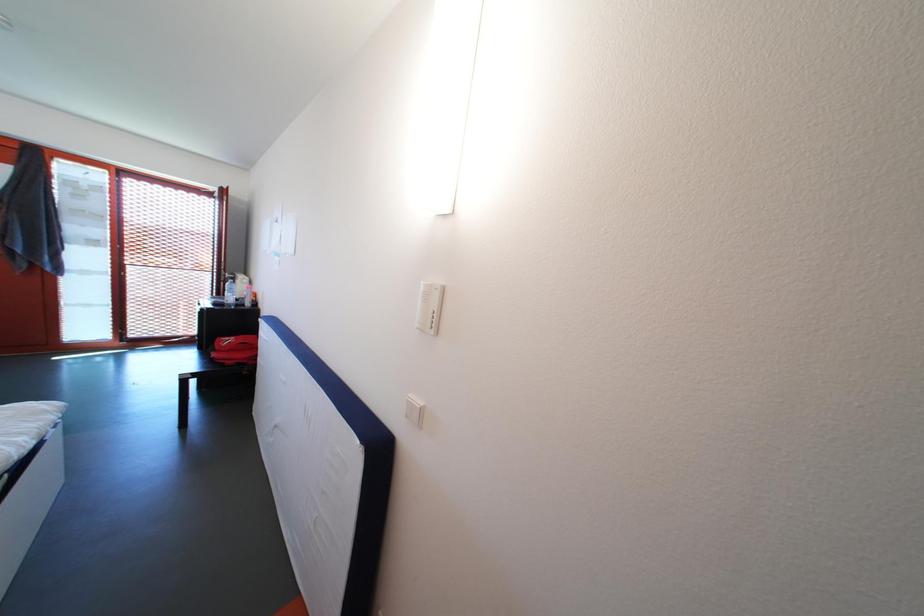
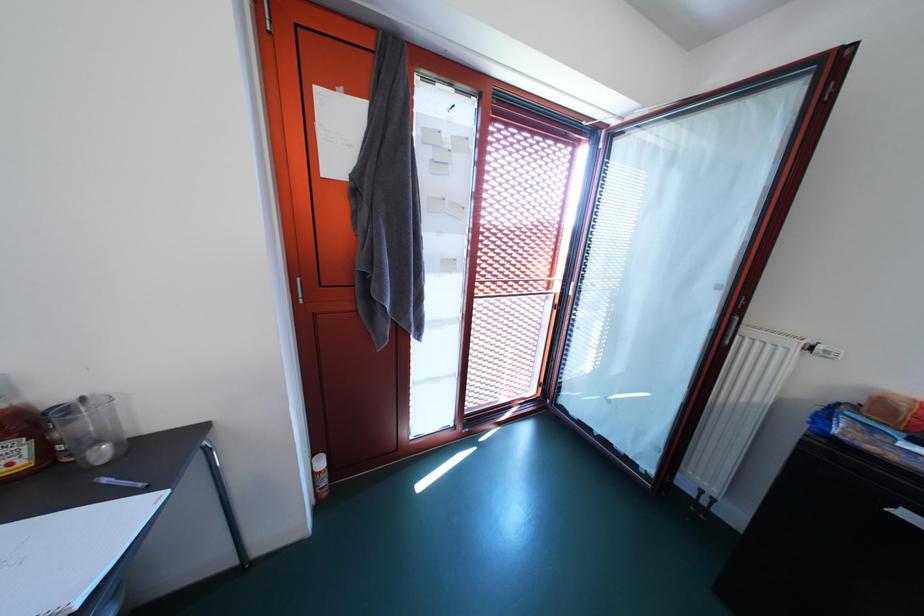
Looking at this image, the images are taken continuously from a first-person perspective. In which direction are you moving?

The cameraman moved toward left, forward.